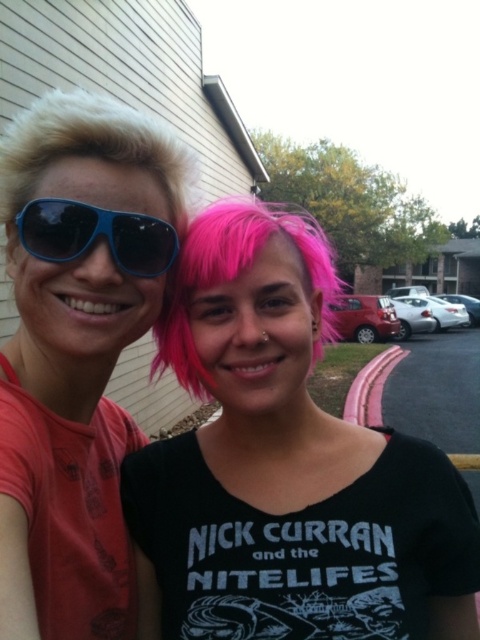
Question: Is pink matte wig at center smaller than blue matte sunglasses at left?

Choices:
 (A) no
 (B) yes

Answer: (A)

Question: Considering the real-world distances, which object is farthest from the pink matte hair at center?

Choices:
 (A) blondehair at left
 (B) pink matte wig at center

Answer: (A)

Question: Which point is farther to the camera?

Choices:
 (A) (132, 260)
 (B) (433, 595)
 (C) (231, 252)
 (D) (3, 193)

Answer: (B)

Question: Does pink matte wig at center lie in front of blondehair at left?

Choices:
 (A) no
 (B) yes

Answer: (B)

Question: Which object is positioned farthest from the blondehair at left?

Choices:
 (A) blue matte sunglasses at left
 (B) pink matte wig at center

Answer: (B)

Question: Does pink matte wig at center have a lesser width compared to pink matte hair at center?

Choices:
 (A) no
 (B) yes

Answer: (B)